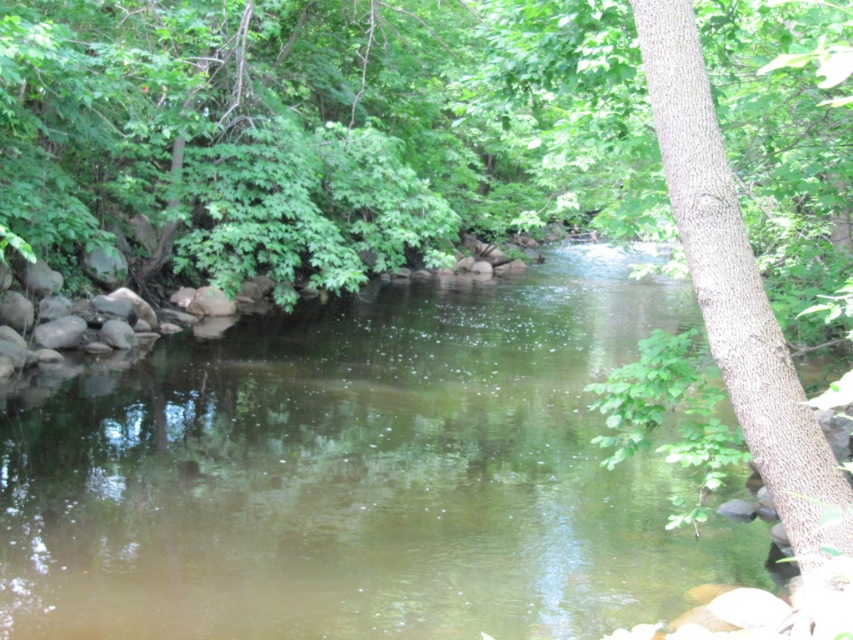
Can you confirm if green smooth water at center is positioned to the left of brown textured tree trunk at right?

Yes, green smooth water at center is to the left of brown textured tree trunk at right.

Between point (202, 620) and point (730, 369), which one is positioned in front?

Point (730, 369)

At what (x,y) coordinates should I click in order to perform the action: click on green smooth water at center. Please return your answer as a coordinate pair (x, y). The height and width of the screenshot is (640, 853). Looking at the image, I should click on coord(360,474).